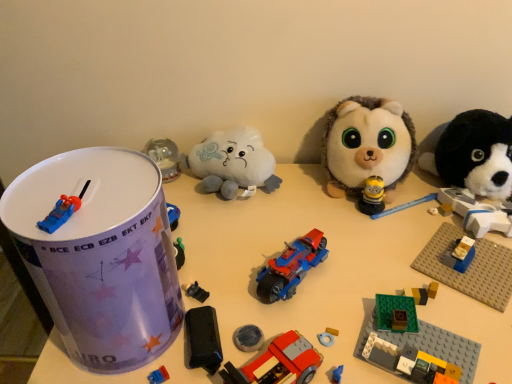
Find the location of `vacant space that's between black plush dog at right, positioned as the 1th toy in right-to-left order, and fluffy white plush at center, the 2th toy viewed from the right`. vacant space that's between black plush dog at right, positioned as the 1th toy in right-to-left order, and fluffy white plush at center, the 2th toy viewed from the right is located at coordinates (409, 206).